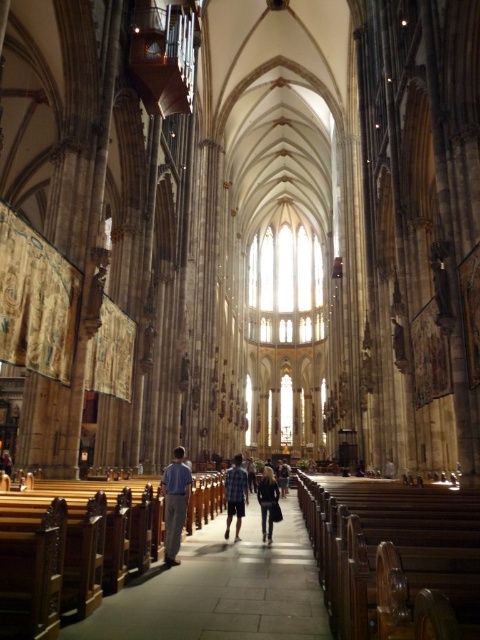
You are a visitor standing at the entrance of the cathedral and notice two shirts hanging on a coat rack at the center. Which shirt is closer to you, the checkered fabric shirt at center or the plaid shirt at center?

The checkered fabric shirt at center is closer to you because it is in front of the plaid shirt at center.

Looking at this image, you are standing at the entrance of the cathedral and see a checkered fabric shirt at center in the middle of the nave. The shirt is 151.35 feet away from you. If you want to walk directly to it, how many steps would you need to take if each step covers approximately 2.5 feet?

The checkered fabric shirt at center is 151.35 feet away. Dividing the distance by the step length of 2.5 feet gives approximately 60.54 steps. Since you can only take whole steps, you would need to take 61 steps to reach the checkered fabric shirt at center.

You are standing in the grand cathedral and see a light blue shirt at center. Where exactly is the light blue shirt located in the cathedral?

The light blue shirt at center is located at point 0.787 on the x axis and 0.365 on the y axis.